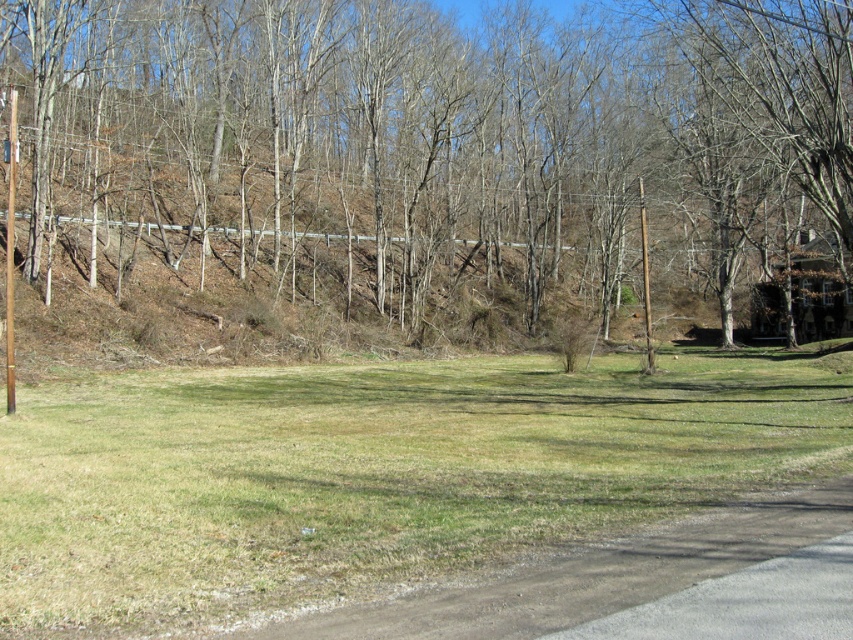
Question: Based on their relative distances, which object is farther from the brown/dry grass at center?

Choices:
 (A) brown wooden telegraph pole at left
 (B) green grass at lower center

Answer: (A)

Question: Among these points, which one is nearest to the camera?

Choices:
 (A) [x=608, y=486]
 (B) [x=491, y=237]
 (C) [x=15, y=150]

Answer: (A)

Question: Does green grass at lower center have a greater width compared to brown wooden telegraph pole at left?

Choices:
 (A) yes
 (B) no

Answer: (A)

Question: Can you confirm if brown/dry grass at center is positioned to the right of green grass at lower center?

Choices:
 (A) yes
 (B) no

Answer: (A)

Question: Does brown/dry grass at center appear on the left side of green grass at lower center?

Choices:
 (A) yes
 (B) no

Answer: (B)

Question: Which point is closer to the camera?

Choices:
 (A) green grass at lower center
 (B) brown/dry grass at center

Answer: (A)